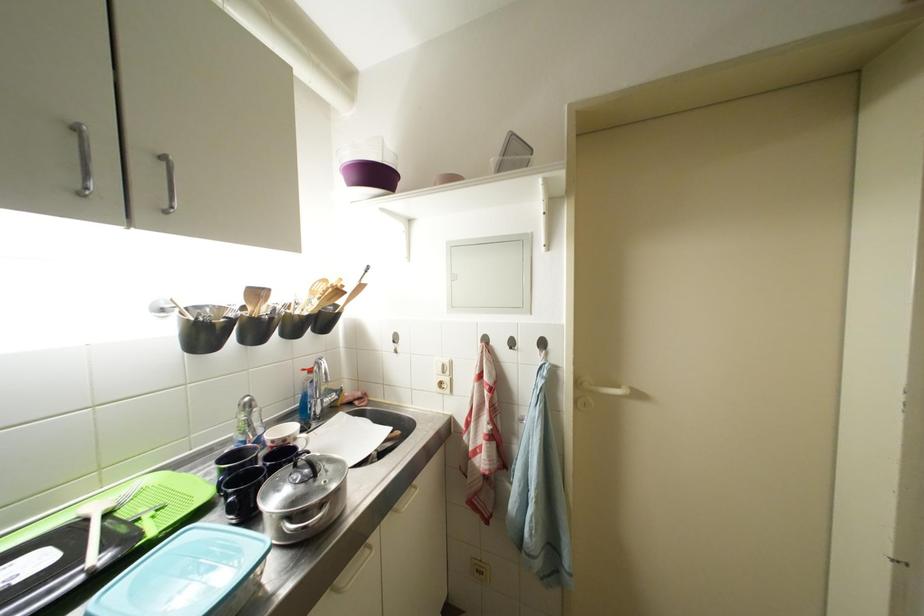
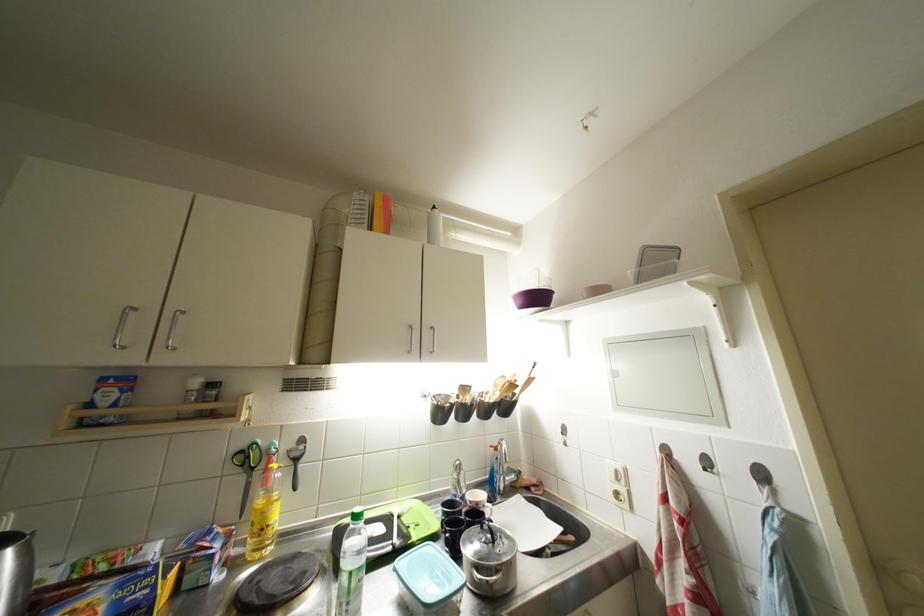
Locate, in the second image, the point that corresponds to [257,429] in the first image.

(466, 487)